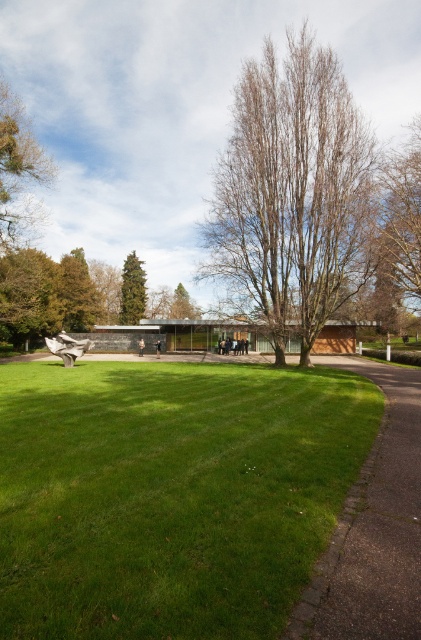
Question: Can you confirm if bare wood tree at center is thinner than paved stone path at lower right?

Choices:
 (A) no
 (B) yes

Answer: (A)

Question: Can you confirm if brown leafy tree at upper right is bigger than green leafy tree at upper left?

Choices:
 (A) no
 (B) yes

Answer: (B)

Question: Can you confirm if brown leafy tree at upper right is wider than green leafy tree at upper left?

Choices:
 (A) yes
 (B) no

Answer: (A)

Question: Which point appears closest to the camera in this image?

Choices:
 (A) (5, 250)
 (B) (188, 611)
 (C) (330, 570)

Answer: (B)

Question: Estimate the real-world distances between objects in this image. Which object is closer to the green leafy tree at upper left?

Choices:
 (A) paved stone path at lower right
 (B) bare wood tree at center

Answer: (B)

Question: Which point is closer to the camera taking this photo?

Choices:
 (A) (13, 160)
 (B) (125, 269)

Answer: (A)